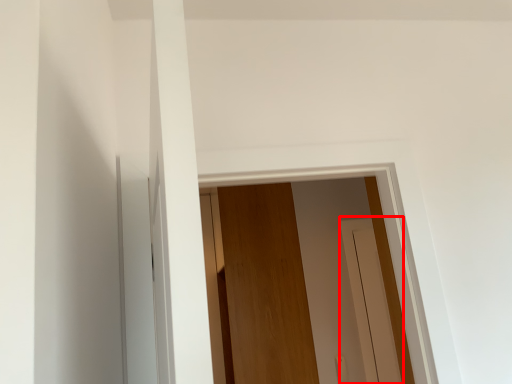
Question: From the image, what is the correct spatial relationship of screen door (annotated by the red box) in relation to door?

Choices:
 (A) left
 (B) right

Answer: (B)